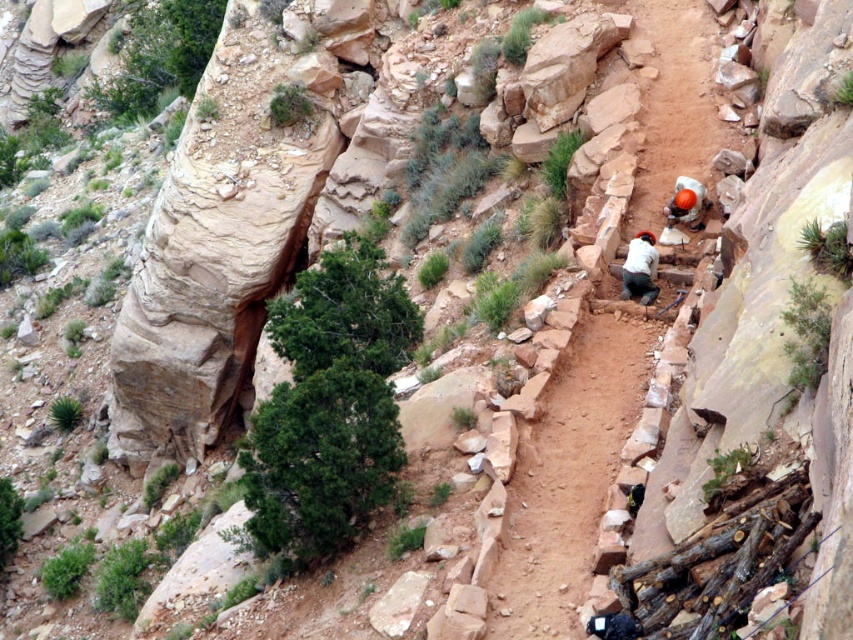
Question: Where is dirt trail at center located in relation to white fabric shirt at center in the image?

Choices:
 (A) left
 (B) right

Answer: (A)

Question: Where is dirt trail at center located in relation to orange helmet at upper right in the image?

Choices:
 (A) below
 (B) above

Answer: (A)

Question: Which of the following is the closest to the observer?

Choices:
 (A) (622, 266)
 (B) (521, 461)

Answer: (B)

Question: Is dirt trail at center smaller than white fabric shirt at center?

Choices:
 (A) yes
 (B) no

Answer: (B)

Question: Which object appears farthest from the camera in this image?

Choices:
 (A) white fabric shirt at center
 (B) orange helmet at upper right

Answer: (B)

Question: Which of these objects is positioned closest to the dirt trail at center?

Choices:
 (A) white fabric shirt at center
 (B) orange helmet at upper right

Answer: (A)